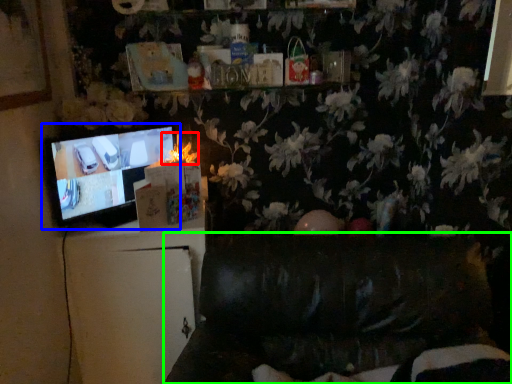
Question: Based on their relative distances, which object is nearer to flower (highlighted by a red box)? Choose from television (highlighted by a blue box) and furniture (highlighted by a green box).

Choices:
 (A) television
 (B) furniture

Answer: (A)